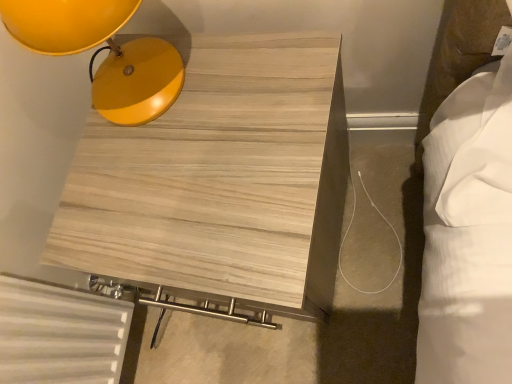
Where is `free space in front of matte yellow lampshade at upper left`? This screenshot has width=512, height=384. free space in front of matte yellow lampshade at upper left is located at coordinates (198, 164).